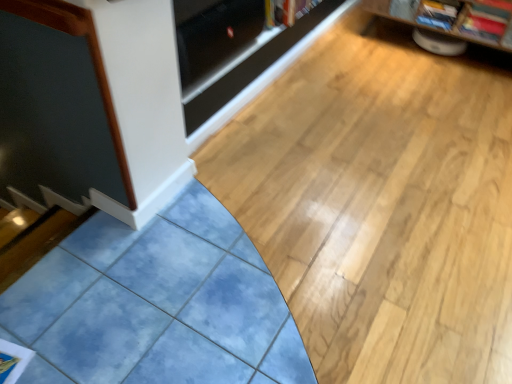
Question: From a real-world perspective, does transparent glass door at upper center sit lower than hardcover book at upper center?

Choices:
 (A) no
 (B) yes

Answer: (A)

Question: Is transparent glass door at upper center positioned with its back to hardcover book at upper center?

Choices:
 (A) yes
 (B) no

Answer: (B)

Question: Does transparent glass door at upper center appear on the left side of hardcover book at upper center?

Choices:
 (A) yes
 (B) no

Answer: (A)

Question: From the image's perspective, would you say transparent glass door at upper center is shown under hardcover book at upper center?

Choices:
 (A) no
 (B) yes

Answer: (B)

Question: Is transparent glass door at upper center shorter than hardcover book at upper center?

Choices:
 (A) no
 (B) yes

Answer: (A)

Question: Does transparent glass door at upper center have a larger size compared to hardcover book at upper center?

Choices:
 (A) no
 (B) yes

Answer: (B)

Question: Is red glossy magazine at upper right, arranged as the 2th magazine when viewed from the left, taller than matte plastic magazine at upper right, marked as the second magazine in a right-to-left arrangement?

Choices:
 (A) no
 (B) yes

Answer: (A)

Question: Is red glossy magazine at upper right, arranged as the 2th magazine when viewed from the left, wider than matte plastic magazine at upper right, arranged as the 1th magazine when viewed from the left?

Choices:
 (A) yes
 (B) no

Answer: (B)

Question: Is red glossy magazine at upper right, arranged as the 2th magazine when viewed from the left, shorter than matte plastic magazine at upper right, marked as the second magazine in a right-to-left arrangement?

Choices:
 (A) yes
 (B) no

Answer: (A)

Question: Is red glossy magazine at upper right, acting as the first magazine starting from the right, looking in the opposite direction of matte plastic magazine at upper right, marked as the second magazine in a right-to-left arrangement?

Choices:
 (A) yes
 (B) no

Answer: (B)

Question: Does red glossy magazine at upper right, arranged as the 2th magazine when viewed from the left, have a lesser width compared to matte plastic magazine at upper right, marked as the second magazine in a right-to-left arrangement?

Choices:
 (A) no
 (B) yes

Answer: (B)

Question: From the image's perspective, would you say red glossy magazine at upper right, acting as the first magazine starting from the right, is shown under matte plastic magazine at upper right, marked as the second magazine in a right-to-left arrangement?

Choices:
 (A) no
 (B) yes

Answer: (B)

Question: Is wooden bookshelf at upper right at the back of red glossy magazine at upper right, arranged as the 2th magazine when viewed from the left?

Choices:
 (A) yes
 (B) no

Answer: (A)